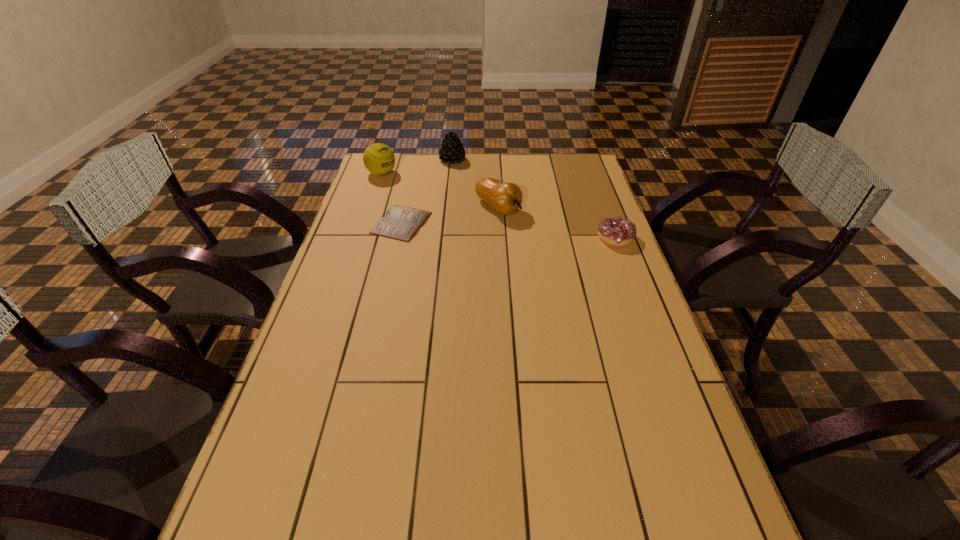
Locate an element on the screen. vacant space located 0.200m at the narrow end of the pinecone is located at coordinates (483, 187).

What are the coordinates of `free point located on the stem side of the gourd` in the screenshot? It's located at (559, 247).

The image size is (960, 540). I want to click on vacant region located on the stem side of the gourd, so click(x=532, y=230).

This screenshot has height=540, width=960. Identify the location of blank space located 0.290m on the stem side of the gourd. (578, 259).

You are a GUI agent. You are given a task and a screenshot of the screen. Output one action in this format:
    pyautogui.click(x=<x>, y=<y>)
    Task: Click on the free space located 0.120m on the logo side of the softball
    The image size is (960, 540).
    Given the screenshot: What is the action you would take?
    pyautogui.click(x=413, y=188)

This screenshot has width=960, height=540. Find the location of `vacant space located on the logo side of the softball`. vacant space located on the logo side of the softball is located at coordinates point(415,189).

Find the location of `free point located on the logo side of the softball`. free point located on the logo side of the softball is located at coordinates (411, 187).

Find the location of a particular element. The height and width of the screenshot is (540, 960). pinecone situated at the far edge is located at coordinates (451, 150).

At what (x,y) coordinates should I click in order to perform the action: click on softball that is positioned at the far edge. Please return your answer as a coordinate pair (x, y). Looking at the image, I should click on (378, 158).

At what (x,y) coordinates should I click in order to perform the action: click on diary at the left edge. Please return your answer as a coordinate pair (x, y). Looking at the image, I should click on (400, 223).